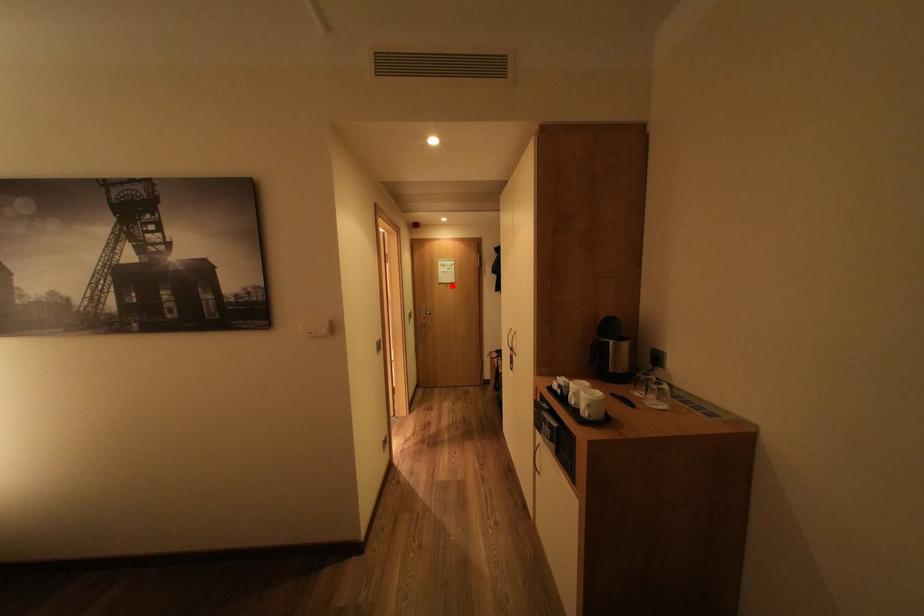
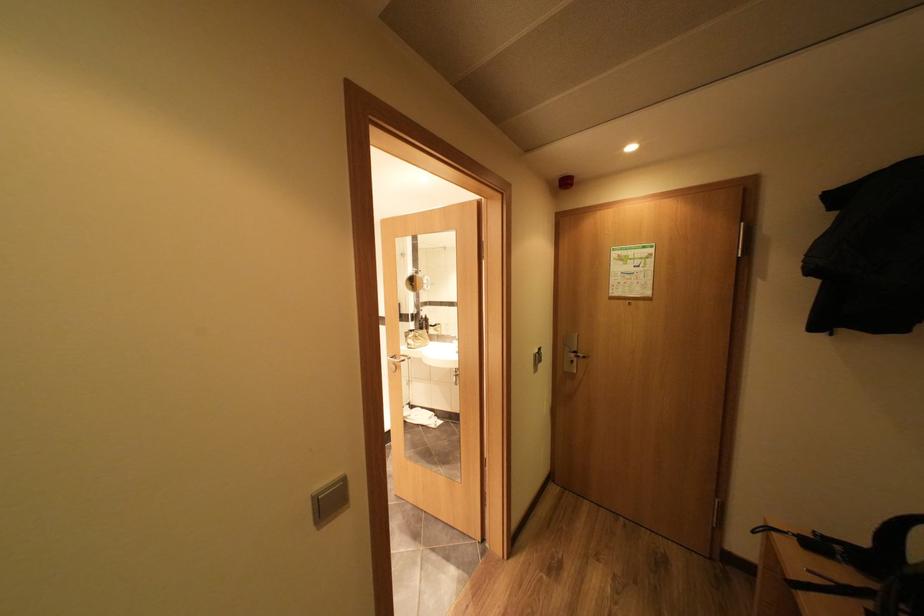
Where in the second image is the point corresponding to the highlighted location from the first image?

(626, 302)